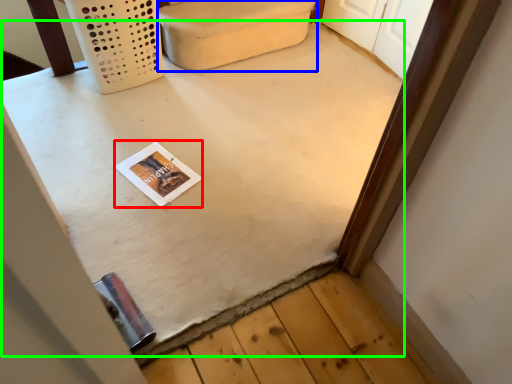
Question: Based on their relative distances, which object is nearer to magazine (highlighted by a red box)? Choose from furniture (highlighted by a blue box) and table (highlighted by a green box).

Choices:
 (A) furniture
 (B) table

Answer: (B)